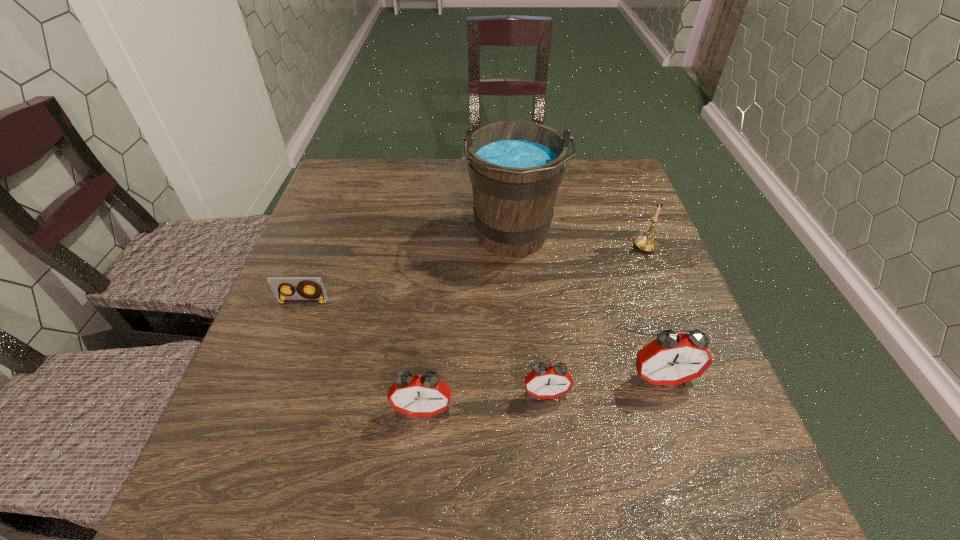
Find the location of a particular element. Image resolution: width=960 pixels, height=540 pixels. the second shortest alarm clock is located at coordinates (425, 395).

Image resolution: width=960 pixels, height=540 pixels. I want to click on the second object from left to right, so click(x=425, y=395).

What are the coordinates of `the fifth tallest object` in the screenshot? It's located at (544, 382).

In order to click on the second alarm clock from left to right in this screenshot , I will do `click(544, 382)`.

The image size is (960, 540). Identify the location of the rightmost alarm clock. (671, 359).

You are a GUI agent. You are given a task and a screenshot of the screen. Output one action in this format:
    pyautogui.click(x=<x>, y=<y>)
    Task: Click on the tallest object
    This screenshot has width=960, height=540.
    Given the screenshot: What is the action you would take?
    pyautogui.click(x=516, y=167)

I want to click on candle holder, so click(x=648, y=244).

This screenshot has height=540, width=960. Find the location of `the fourth nearest object`. the fourth nearest object is located at coordinates (316, 293).

Identify the location of the leftmost object. The image size is (960, 540). (316, 293).

Where is `free space located on the clock face of the second shortest object`? The height and width of the screenshot is (540, 960). free space located on the clock face of the second shortest object is located at coordinates (551, 440).